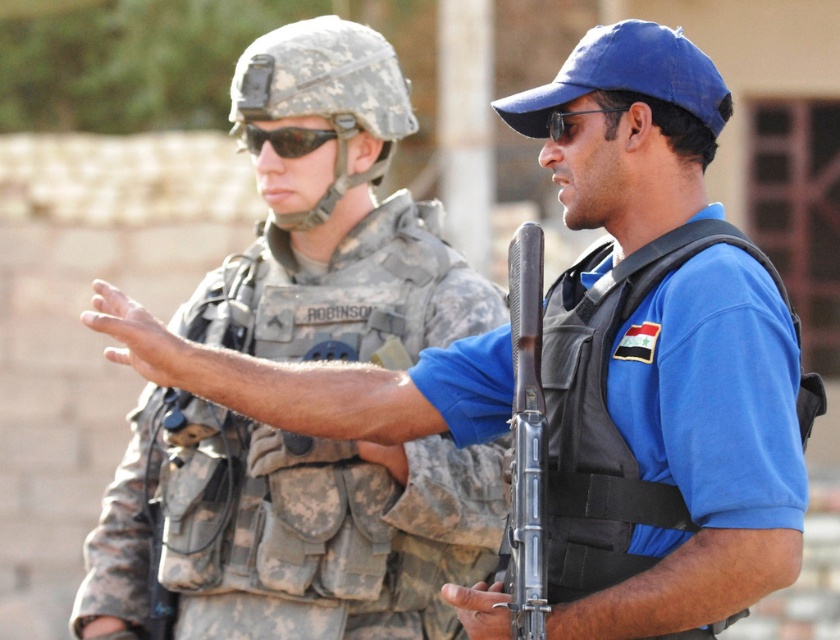
You are a drone operator trying to identify the positions of two points in a security zone. The first point is labeled as point (x=368, y=243) and the second as point (x=528, y=237). Based on the scene provided, which point is located behind the other?

Point (x=368, y=243) is behind point (x=528, y=237).

You are a security officer tasked with identifying the position of the silver metallic rifle at center in the image. According to the coordinates provided, where exactly is the rifle positioned?

The silver metallic rifle at center is located at point (526, 440).

Consider the image. You are a drone operator trying to identify the closest point to the civilian in the image. The points you need to consider are point (538, 637) and point (285, 154). Which point is closer to the civilian?

Point (538, 637) is in front of point (285, 154), so it is closer to the civilian.